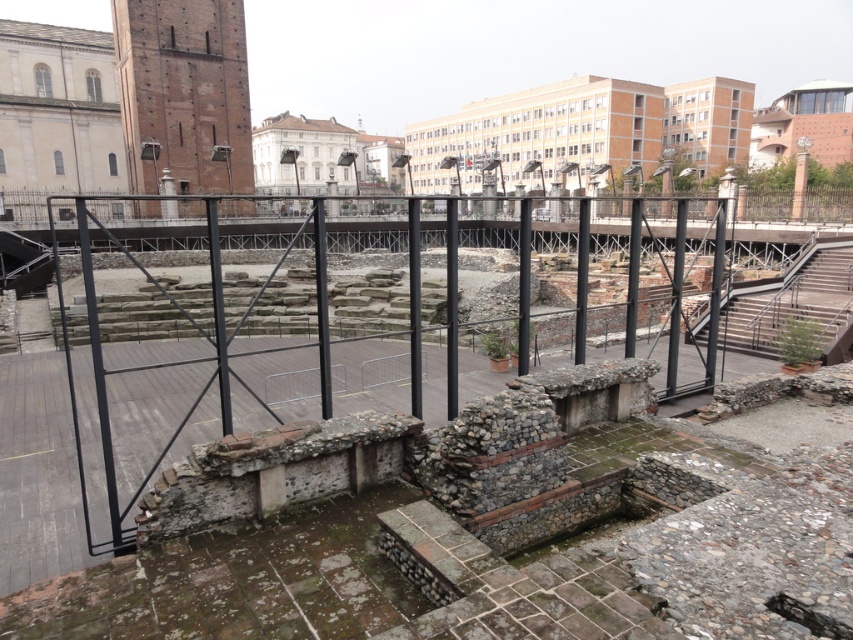
Question: Which point appears farthest from the camera in this image?

Choices:
 (A) (234, 125)
 (B) (817, 273)

Answer: (A)

Question: Does brick tower at upper left have a greater width compared to rustic stone stairs at right?

Choices:
 (A) yes
 (B) no

Answer: (A)

Question: Does brick tower at upper left come in front of rustic stone stairs at right?

Choices:
 (A) no
 (B) yes

Answer: (A)

Question: Does brick tower at upper left have a larger size compared to rustic stone stairs at right?

Choices:
 (A) yes
 (B) no

Answer: (A)

Question: Which object is farther from the camera taking this photo?

Choices:
 (A) brick tower at upper left
 (B) rustic stone stairs at right

Answer: (A)